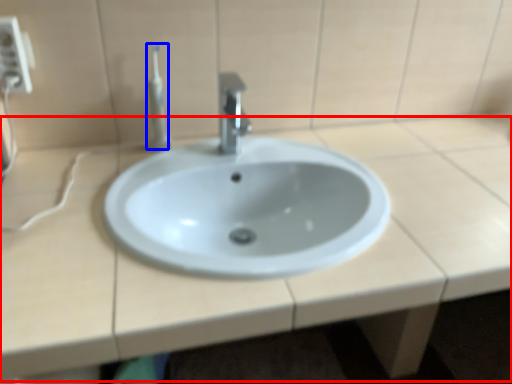
Question: Which object is closer to the camera taking this photo, counter top (highlighted by a red box) or toothbrush (highlighted by a blue box)?

Choices:
 (A) counter top
 (B) toothbrush

Answer: (A)